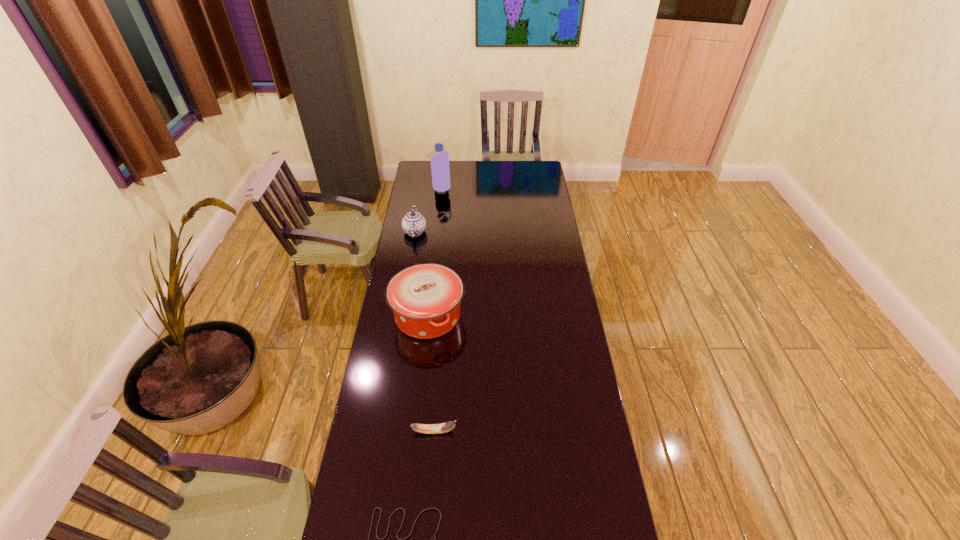
Where is `vacant area situated on the peel of the second nearest object`? This screenshot has height=540, width=960. vacant area situated on the peel of the second nearest object is located at coordinates (478, 431).

Where is `shampoo that is positioned at the left edge`? Image resolution: width=960 pixels, height=540 pixels. shampoo that is positioned at the left edge is located at coordinates (440, 169).

Find the location of a particular element. This screenshot has height=540, width=960. casserole at the left edge is located at coordinates (425, 298).

Where is `chinaware located in the left edge section of the desktop`? The width and height of the screenshot is (960, 540). chinaware located in the left edge section of the desktop is located at coordinates (413, 223).

The height and width of the screenshot is (540, 960). I want to click on vacant space at the left edge of the desktop, so point(362,490).

Locate an element on the screen. Image resolution: width=960 pixels, height=540 pixels. blank space at the right edge of the desktop is located at coordinates (593, 467).

At what (x,y) coordinates should I click in order to perform the action: click on free region at the far left corner. Please return your answer as a coordinate pair (x, y). The width and height of the screenshot is (960, 540). Looking at the image, I should click on (424, 179).

Identify the location of free space at the far right corner. (541, 177).

Locate an element on the screen. The image size is (960, 540). vacant point located between the chinaware and the farthest object is located at coordinates (427, 210).

This screenshot has width=960, height=540. Identify the location of free space between the banana and the third nearest object. (431, 373).